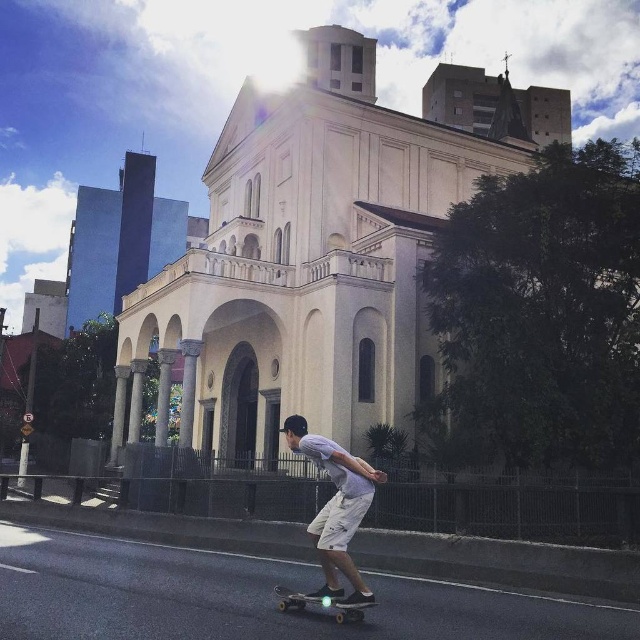
Does light gray cotton t-shirt at center appear on the right side of metallic silver skateboard at lower center?

No, light gray cotton t-shirt at center is not to the right of metallic silver skateboard at lower center.

Does point (333, 513) come farther from viewer compared to point (296, 593)?

Yes, point (333, 513) is behind point (296, 593).

Locate an element on the screen. The width and height of the screenshot is (640, 640). light gray cotton t-shirt at center is located at coordinates (337, 508).